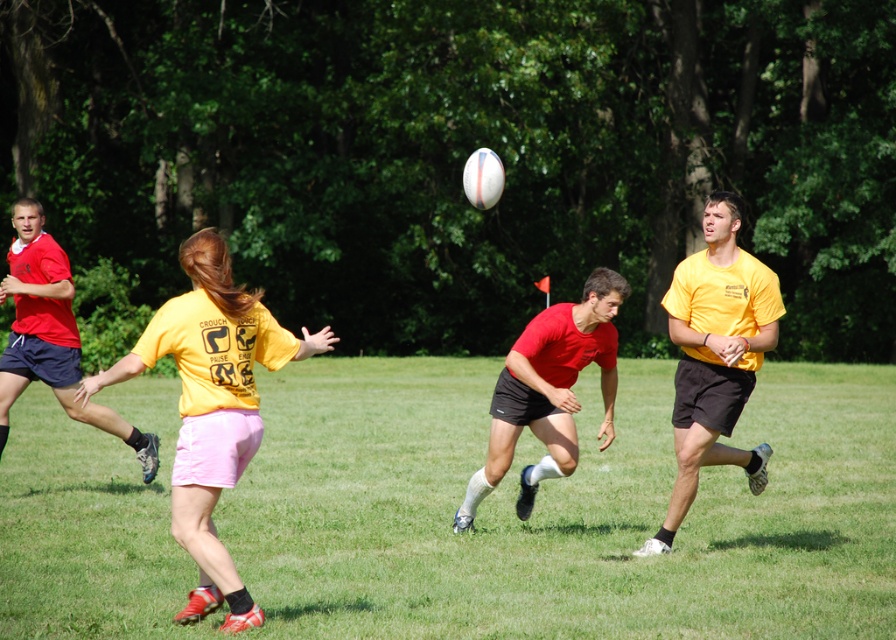
Question: Can you confirm if yellow matte shirt at center is bigger than yellow matte shirt at right?

Choices:
 (A) yes
 (B) no

Answer: (B)

Question: Which point is farther from the camera taking this photo?

Choices:
 (A) (521, 336)
 (B) (153, 353)
 (C) (672, 300)

Answer: (A)

Question: Which point appears closest to the camera in this image?

Choices:
 (A) (220, 273)
 (B) (669, 548)
 (C) (514, 394)

Answer: (A)

Question: Is yellow matte shirt at right above matte red shorts at center?

Choices:
 (A) yes
 (B) no

Answer: (A)

Question: Is yellow matte shirt at center bigger than yellow matte shirt at right?

Choices:
 (A) yes
 (B) no

Answer: (B)

Question: Which point is closer to the camera taking this photo?

Choices:
 (A) (467, 506)
 (B) (725, 301)
 (C) (265, 314)

Answer: (C)